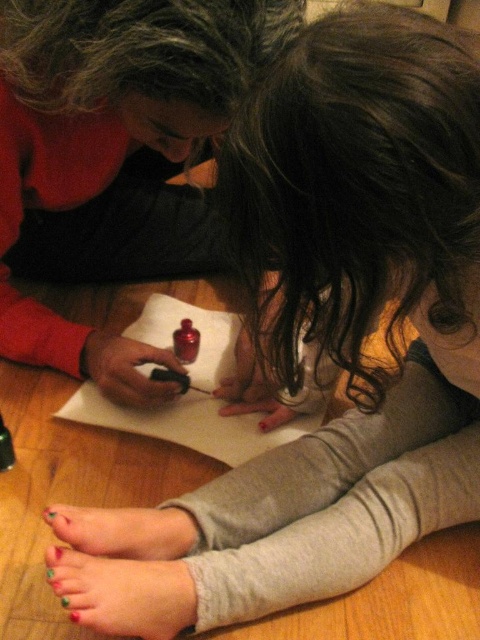
Which is in front, point (427, 170) or point (132, 72)?

Point (427, 170) is in front.

Is dark curly hair at center in front of matte black nail polish at center?

Yes, it is.

Between point (328, 221) and point (105, 100), which one is positioned behind?

Positioned behind is point (105, 100).

Find the location of a particular element. dark curly hair at center is located at coordinates (354, 189).

Is dark brown curly hair at upper center to the left of white paper at center from the viewer's perspective?

In fact, dark brown curly hair at upper center is to the right of white paper at center.

Does dark brown curly hair at upper center appear on the right side of white paper at center?

Yes, dark brown curly hair at upper center is to the right of white paper at center.

In the scene shown: Who is more forward, (x=226, y=36) or (x=239, y=326)?

Point (x=226, y=36) is in front.

Where is `dark brown curly hair at upper center`? dark brown curly hair at upper center is located at coordinates (140, 49).

Describe the element at coordinates (354, 189) in the screenshot. I see `dark curly hair at center` at that location.

Does dark curly hair at center have a lesser width compared to matte black crayon at center?

Incorrect, dark curly hair at center's width is not less than matte black crayon at center's.

The width and height of the screenshot is (480, 640). Describe the element at coordinates (354, 189) in the screenshot. I see `dark curly hair at center` at that location.

Identify the location of dark curly hair at center. (354, 189).